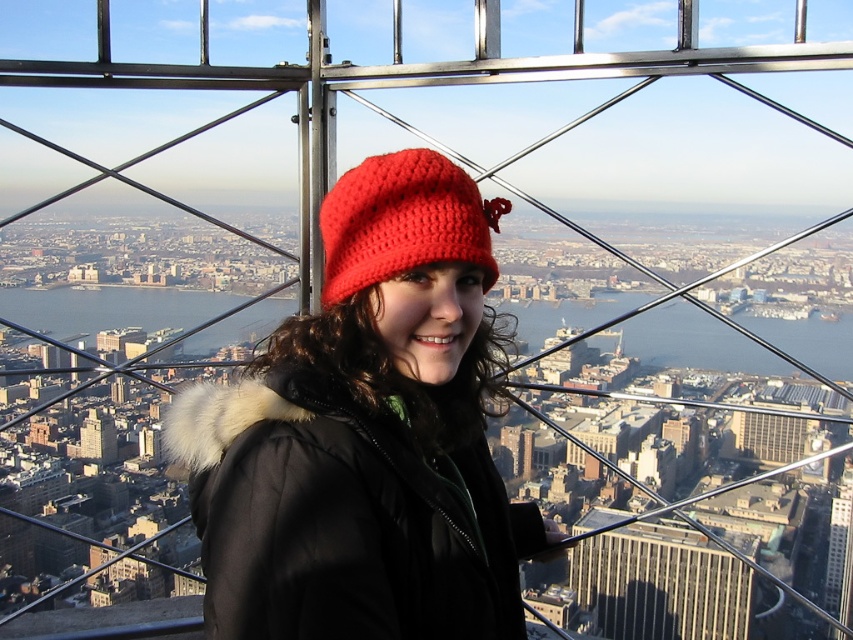
Between red knitted hat at center and metallic glass skyscraper at center, which one appears on the right side from the viewer's perspective?

Positioned to the right is metallic glass skyscraper at center.

Is red knitted hat at center to the right of metallic glass skyscraper at center from the viewer's perspective?

No, red knitted hat at center is not to the right of metallic glass skyscraper at center.

Describe the element at coordinates (403, 221) in the screenshot. The width and height of the screenshot is (853, 640). I see `red knitted hat at center` at that location.

The height and width of the screenshot is (640, 853). I want to click on red knitted hat at center, so click(403, 221).

Which is behind, point (445, 209) or point (833, 536)?

The point (833, 536) is more distant.

Where is `red knitted hat at center`? This screenshot has width=853, height=640. red knitted hat at center is located at coordinates (403, 221).

Identify the location of red knitted hat at center. (403, 221).

Does crochet knit hat at center have a lesser width compared to red knitted hat at center?

No, crochet knit hat at center is not thinner than red knitted hat at center.

Is point (492, 582) closer to viewer compared to point (386, 224)?

Yes, point (492, 582) is in front of point (386, 224).

The width and height of the screenshot is (853, 640). I want to click on crochet knit hat at center, so click(366, 435).